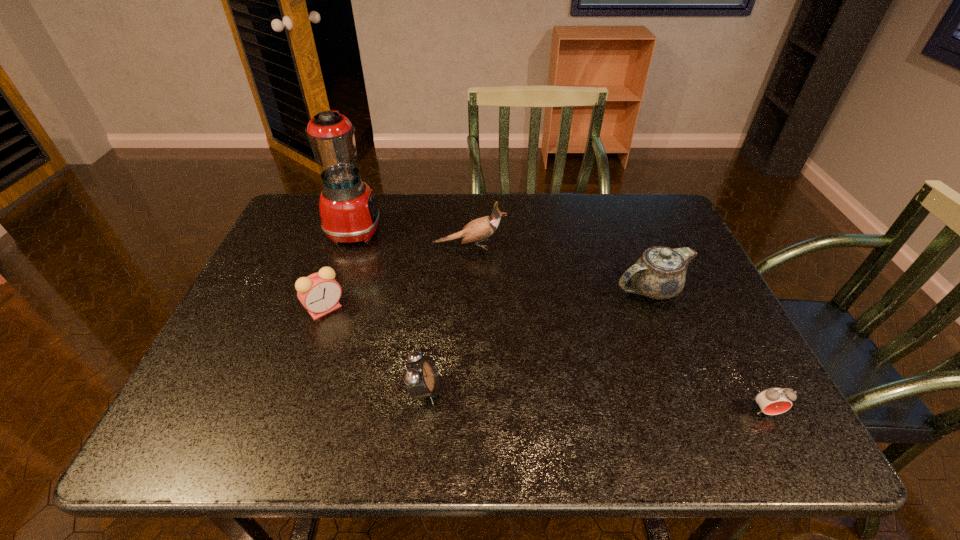
The width and height of the screenshot is (960, 540). In order to click on free space between the second alarm clock from right to left and the leftmost alarm clock in this screenshot , I will do `click(374, 349)`.

Where is `vacant area that lies between the second alarm clock from right to left and the fifth object from left to right`? vacant area that lies between the second alarm clock from right to left and the fifth object from left to right is located at coordinates (538, 340).

Find the location of a particular element. The width and height of the screenshot is (960, 540). vacant space in between the leftmost alarm clock and the shortest object is located at coordinates (545, 360).

Where is `free area in between the farthest alarm clock and the second alarm clock from right to left`? The image size is (960, 540). free area in between the farthest alarm clock and the second alarm clock from right to left is located at coordinates (374, 349).

The height and width of the screenshot is (540, 960). Find the location of `free space between the chinaware and the tallest object`. free space between the chinaware and the tallest object is located at coordinates (503, 259).

Identify the location of free space that is in between the rightmost object and the chinaware. (708, 350).

Where is `vacant space that's between the rightmost alarm clock and the leftmost alarm clock`? This screenshot has width=960, height=540. vacant space that's between the rightmost alarm clock and the leftmost alarm clock is located at coordinates (545, 360).

I want to click on object that stands as the fifth closest to the second alarm clock from right to left, so click(x=772, y=401).

Identify which object is the nearest to the farthest alarm clock. Please provide its 2D coordinates. Your answer should be formatted as a tuple, i.e. [(x, y)], where the tuple contains the x and y coordinates of a point satisfying the conditions above.

[(349, 214)]

Identify which alarm clock is the nearest to the shortest alarm clock. Please provide its 2D coordinates. Your answer should be formatted as a tuple, i.e. [(x, y)], where the tuple contains the x and y coordinates of a point satisfying the conditions above.

[(421, 376)]